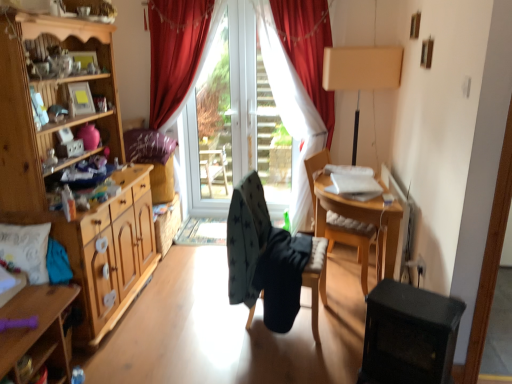
The width and height of the screenshot is (512, 384). What do you see at coordinates (271, 260) in the screenshot?
I see `dark gray fabric chair at center, acting as the 2th chair starting from the right` at bounding box center [271, 260].

Identify the location of wooden chair at right, marked as the second chair in a left-to-right arrangement. (350, 234).

What do you see at coordinates (148, 146) in the screenshot? Image resolution: width=512 pixels, height=384 pixels. I see `velvet purple pillow at upper center, the 2th pillow from the bottom` at bounding box center [148, 146].

Describe the element at coordinates (70, 165) in the screenshot. The width and height of the screenshot is (512, 384). I see `wooden cabinet at left` at that location.

This screenshot has height=384, width=512. I want to click on wooden desk at lower left, so click(37, 331).

Does wooden desk at lower left turn towards wooden chair at right, which ranks as the first chair in right-to-left order?

No, wooden desk at lower left is not turned towards wooden chair at right, which ranks as the first chair in right-to-left order.

From the image's perspective, would you say wooden desk at lower left is shown under wooden chair at right, marked as the second chair in a left-to-right arrangement?

Yes, from the image's perspective, wooden desk at lower left is beneath wooden chair at right, marked as the second chair in a left-to-right arrangement.

Is the depth of wooden desk at lower left greater than that of wooden chair at right, which ranks as the first chair in right-to-left order?

No, wooden desk at lower left is closer to the viewer.

Does point (39, 363) appear closer or farther from the camera than point (362, 283)?

Point (39, 363) is positioned closer to the camera compared to point (362, 283).

Between wooden table at center and beige fabric lampshade at upper right, which one has smaller width?

beige fabric lampshade at upper right.

From a real-world perspective, is wooden table at center positioned above or below beige fabric lampshade at upper right?

In terms of real-world spatial position, wooden table at center is below beige fabric lampshade at upper right.

Can you confirm if wooden table at center is positioned to the right of beige fabric lampshade at upper right?

No, wooden table at center is not to the right of beige fabric lampshade at upper right.

Could you tell me if wooden table at center is turned towards beige fabric lampshade at upper right?

No, wooden table at center is not facing towards beige fabric lampshade at upper right.

Is wooden cabinet at left not close to velvet purple pillow at upper center, which appears as the first pillow when viewed from the top?

wooden cabinet at left is near velvet purple pillow at upper center, which appears as the first pillow when viewed from the top, not far away.

Is wooden cabinet at left oriented away from velvet purple pillow at upper center, the 2th pillow from the bottom?

No.

Relative to velvet purple pillow at upper center, the 2th pillow from the bottom, is wooden cabinet at left in front or behind?

wooden cabinet at left is in front of velvet purple pillow at upper center, the 2th pillow from the bottom.

Does wooden cabinet at left have a greater width compared to velvet purple pillow at upper center, which appears as the first pillow when viewed from the top?

Incorrect, the width of wooden cabinet at left does not surpass that of velvet purple pillow at upper center, which appears as the first pillow when viewed from the top.

Is red velvet curtain at center oriented away from velvet purple pillow at upper center, which ranks as the first pillow in back-to-front order?

No, red velvet curtain at center's orientation is not away from velvet purple pillow at upper center, which ranks as the first pillow in back-to-front order.

Is red velvet curtain at center at the left side of velvet purple pillow at upper center, which appears as the first pillow when viewed from the top?

Incorrect, red velvet curtain at center is not on the left side of velvet purple pillow at upper center, which appears as the first pillow when viewed from the top.

Is red velvet curtain at center next to velvet purple pillow at upper center, the 2th pillow from the bottom?

red velvet curtain at center and velvet purple pillow at upper center, the 2th pillow from the bottom, are clearly separated.

Is red velvet curtain at center wider or thinner than velvet purple pillow at upper center, which ranks as the first pillow in back-to-front order?

In the image, red velvet curtain at center appears to be more narrow than velvet purple pillow at upper center, which ranks as the first pillow in back-to-front order.

What's the angular difference between red velvet curtain at center and dark gray fabric chair at center, acting as the 2th chair starting from the right,'s facing directions?

red velvet curtain at center and dark gray fabric chair at center, acting as the 2th chair starting from the right, are facing 80.9 degrees away from each other.

Considering the sizes of red velvet curtain at center and dark gray fabric chair at center, acting as the 2th chair starting from the right, in the image, is red velvet curtain at center wider or thinner than dark gray fabric chair at center, acting as the 2th chair starting from the right,?

red velvet curtain at center is thinner than dark gray fabric chair at center, acting as the 2th chair starting from the right.

From a real-world perspective, is red velvet curtain at center above or below dark gray fabric chair at center, acting as the 2th chair starting from the right?

red velvet curtain at center is situated higher than dark gray fabric chair at center, acting as the 2th chair starting from the right, in the real world.

Is red velvet curtain at center positioned beyond the bounds of dark gray fabric chair at center, acting as the 2th chair starting from the right?

red velvet curtain at center lies outside dark gray fabric chair at center, acting as the 2th chair starting from the right,'s area.

Which object is wider, transparent glass door at center or red velvet curtain at center?

With larger width is red velvet curtain at center.

The width and height of the screenshot is (512, 384). What are the coordinates of `curtain that is on the right side of transparent glass door at center` in the screenshot? It's located at (296, 104).

In the image, is transparent glass door at center positioned in front of or behind red velvet curtain at center?

transparent glass door at center is positioned farther from the viewer than red velvet curtain at center.

In the scene shown: Is transparent glass door at center situated inside red velvet curtain at center or outside?

transparent glass door at center is not enclosed by red velvet curtain at center.

Find the location of a particular element. The height and width of the screenshot is (384, 512). lamp above the wooden chair at right, which ranks as the first chair in right-to-left order (from a real-world perspective) is located at coordinates (361, 73).

Is wooden chair at right, marked as the second chair in a left-to-right arrangement, thinner than beige fabric lampshade at upper right?

No, wooden chair at right, marked as the second chair in a left-to-right arrangement, is not thinner than beige fabric lampshade at upper right.

Is beige fabric lampshade at upper right at the back of wooden chair at right, marked as the second chair in a left-to-right arrangement?

wooden chair at right, marked as the second chair in a left-to-right arrangement, is not turned away from beige fabric lampshade at upper right.

Would you say beige fabric lampshade at upper right is part of wooden chair at right, which ranks as the first chair in right-to-left order,'s contents?

No, wooden chair at right, which ranks as the first chair in right-to-left order, does not contain beige fabric lampshade at upper right.

From a real-world perspective, starting from the wooden desk at lower left, which chair is the 2nd one vertically above it? Please provide its 2D coordinates.

[(350, 234)]

In the image, there is a beige fabric lampshade at upper right. In order to click on table below it (from a real-world perspective) in this screenshot , I will do `click(358, 225)`.

When comparing their distances from white textured pillow at left, positioned as the first pillow in bottom-to-top order, does dark gray fabric chair at center, which is the 1th chair in left-to-right order, or transparent glass door at center seem further?

Based on the image, transparent glass door at center appears to be further to white textured pillow at left, positioned as the first pillow in bottom-to-top order.

Looking at this image, which object lies nearer to the anchor point wooden chair at right, marked as the second chair in a left-to-right arrangement, beige fabric lampshade at upper right or velvet purple pillow at upper center, the second pillow from the front?

Among the two, beige fabric lampshade at upper right is located nearer to wooden chair at right, marked as the second chair in a left-to-right arrangement.

When comparing their distances from white textured pillow at left, positioned as the first pillow in bottom-to-top order, does transparent glass door at center or beige fabric lampshade at upper right seem closer?

Among the two, transparent glass door at center is located nearer to white textured pillow at left, positioned as the first pillow in bottom-to-top order.

Looking at the image, which one is located closer to wooden desk at lower left, velvet purple pillow at upper center, the 2th pillow from the bottom, or wooden chair at right, marked as the second chair in a left-to-right arrangement?

velvet purple pillow at upper center, the 2th pillow from the bottom, is positioned closer to the anchor wooden desk at lower left.

Considering their positions, is wooden cabinet at left positioned closer to wooden table at center than beige fabric lampshade at upper right?

Among the two, beige fabric lampshade at upper right is located nearer to wooden table at center.

Based on their spatial positions, is wooden table at center or red velvet curtain at center further from velvet purple pillow at upper center, which ranks as the first pillow in back-to-front order?

wooden table at center.

Based on their spatial positions, is wooden table at center or red velvet curtain at center further from transparent glass door at center?

Among the two, wooden table at center is located further to transparent glass door at center.

From the image, which object appears to be nearer to wooden cabinet at left, wooden table at center or red velvet curtain at center?

Among the two, wooden table at center is located nearer to wooden cabinet at left.

Identify the location of chair between wooden cabinet at left and wooden table at center in the horizontal direction. This screenshot has width=512, height=384. (271, 260).

This screenshot has height=384, width=512. What are the coordinates of `pillow between wooden desk at lower left and wooden table at center in the horizontal direction` in the screenshot? It's located at (148, 146).

Locate an element on the screen. cabinetry between wooden desk at lower left and beige fabric lampshade at upper right is located at coordinates (70, 165).

The width and height of the screenshot is (512, 384). What are the coordinates of `curtain between velvet purple pillow at upper center, which appears as the first pillow when viewed from the top, and wooden table at center` in the screenshot? It's located at (296, 104).